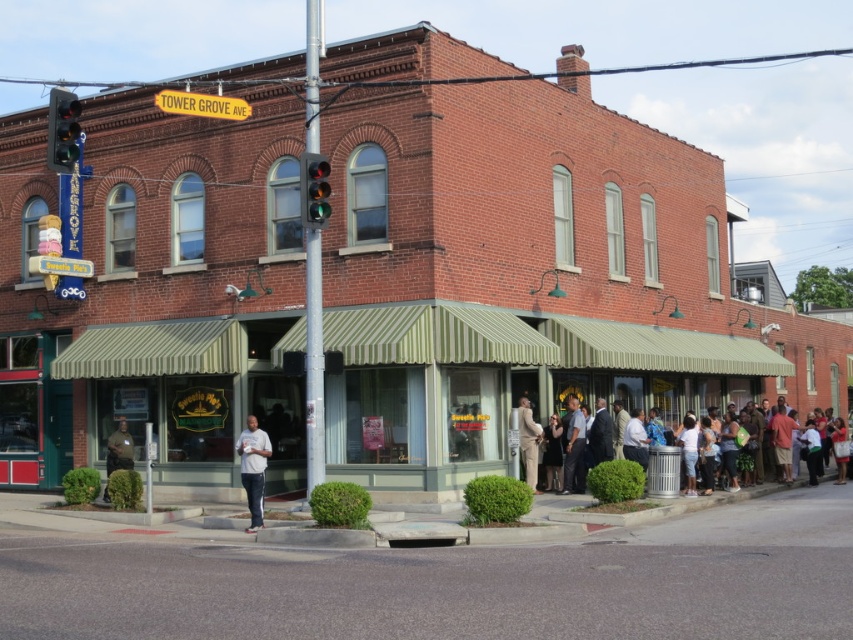
Can you confirm if yellowmaterial/texturestreet sign at upper center is shorter than dark brown fabric crowd at center?

Correct, yellowmaterial/texturestreet sign at upper center is not as tall as dark brown fabric crowd at center.

You are a GUI agent. You are given a task and a screenshot of the screen. Output one action in this format:
    pyautogui.click(x=<x>, y=<y>)
    Task: Click on the yellowmaterial/texturestreet sign at upper center
    
    Given the screenshot: What is the action you would take?
    pyautogui.click(x=201, y=104)

Is yellowmaterial/texturestreet sign at upper center thinner than tan fabric suit at center?

Incorrect, yellowmaterial/texturestreet sign at upper center's width is not less than tan fabric suit at center's.

Does yellowmaterial/texturestreet sign at upper center have a larger size compared to tan fabric suit at center?

Actually, yellowmaterial/texturestreet sign at upper center might be smaller than tan fabric suit at center.

Between point (200, 102) and point (525, 438), which one is positioned in front?

Positioned in front is point (200, 102).

Locate an element on the screen. This screenshot has width=853, height=640. yellowmaterial/texturestreet sign at upper center is located at coordinates (201, 104).

Does gray cotton shirt at center appear on the right side of tan fabric suit at center?

No, gray cotton shirt at center is not to the right of tan fabric suit at center.

Is point (258, 480) positioned in front of point (537, 456)?

Yes, point (258, 480) is in front of point (537, 456).

Where is `gray cotton shirt at center`? gray cotton shirt at center is located at coordinates (253, 468).